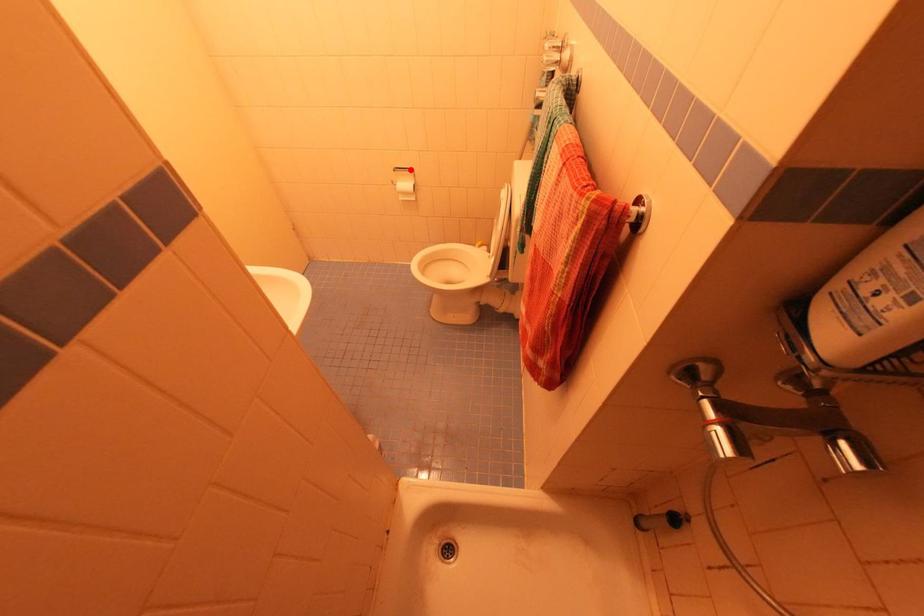
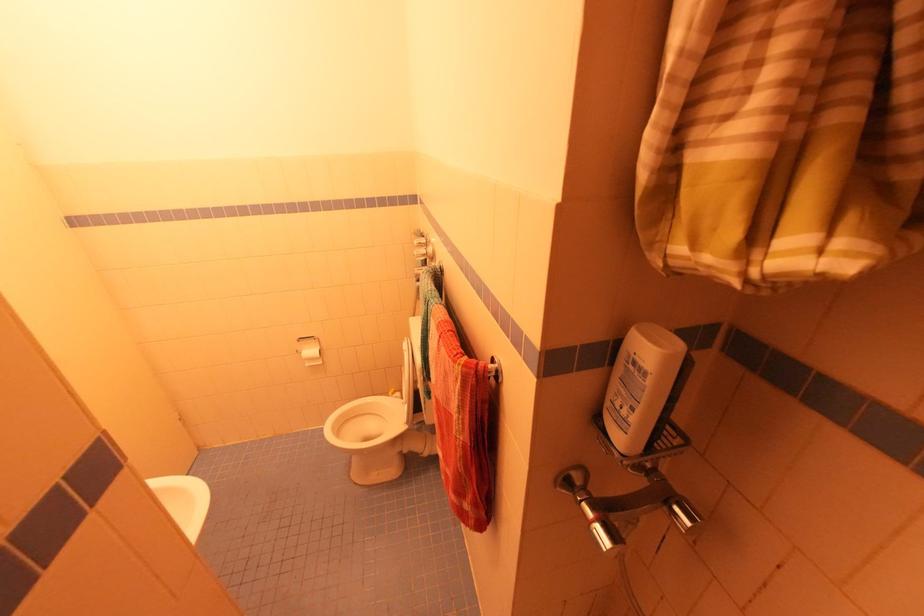
Locate, in the second image, the point that corresponds to the highlighted location in the first image.

(314, 338)